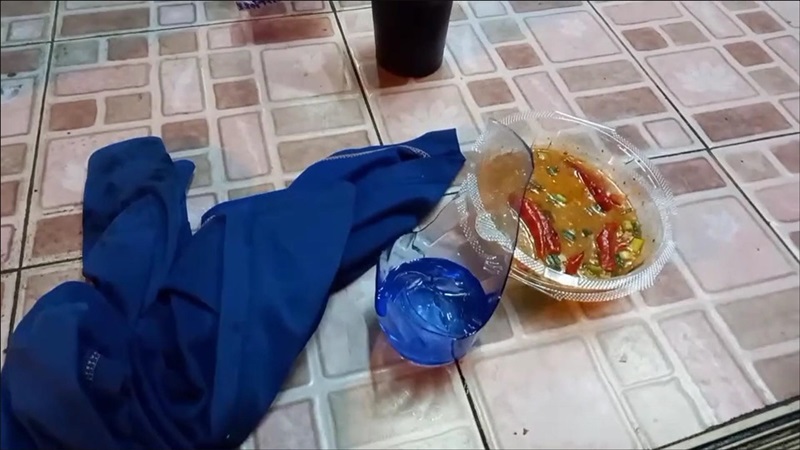
Locate an element on the screen. edge of table is located at coordinates (778, 438).